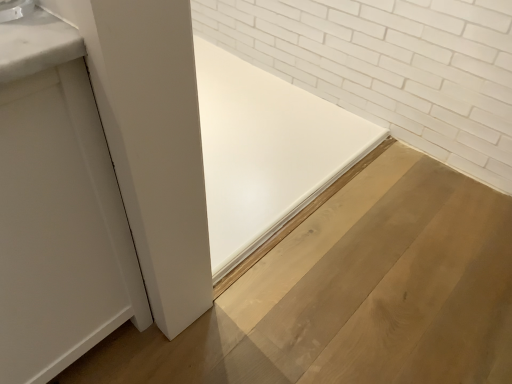
Question: Is white matte door at left oriented towards natural wood plywood at center?

Choices:
 (A) no
 (B) yes

Answer: (A)

Question: Considering the relative sizes of white matte door at left and natural wood plywood at center in the image provided, is white matte door at left taller than natural wood plywood at center?

Choices:
 (A) no
 (B) yes

Answer: (B)

Question: Does white matte door at left appear on the right side of natural wood plywood at center?

Choices:
 (A) no
 (B) yes

Answer: (A)

Question: Does white matte door at left have a greater width compared to natural wood plywood at center?

Choices:
 (A) yes
 (B) no

Answer: (B)

Question: From a real-world perspective, is white matte door at left under natural wood plywood at center?

Choices:
 (A) no
 (B) yes

Answer: (A)

Question: In terms of width, does satin nickel faucet at upper left look wider or thinner when compared to white matte door at left?

Choices:
 (A) thin
 (B) wide

Answer: (A)

Question: In the image, is satin nickel faucet at upper left on the left side or the right side of white matte door at left?

Choices:
 (A) right
 (B) left

Answer: (A)

Question: Is satin nickel faucet at upper left situated inside white matte door at left or outside?

Choices:
 (A) inside
 (B) outside

Answer: (B)

Question: In terms of height, does satin nickel faucet at upper left look taller or shorter compared to white matte door at left?

Choices:
 (A) tall
 (B) short

Answer: (B)

Question: Is white matte door at left taller or shorter than satin nickel faucet at upper left?

Choices:
 (A) short
 (B) tall

Answer: (B)

Question: Is white matte door at left situated inside satin nickel faucet at upper left or outside?

Choices:
 (A) outside
 (B) inside

Answer: (A)

Question: Looking at the image, does white matte door at left seem bigger or smaller compared to satin nickel faucet at upper left?

Choices:
 (A) big
 (B) small

Answer: (A)

Question: From a real-world perspective, is white matte door at left positioned above or below satin nickel faucet at upper left?

Choices:
 (A) above
 (B) below

Answer: (B)

Question: Looking at their shapes, would you say white matte door at left is wider or thinner than natural wood plywood at center?

Choices:
 (A) wide
 (B) thin

Answer: (B)

Question: Does point (55, 109) appear closer or farther from the camera than point (329, 354)?

Choices:
 (A) farther
 (B) closer

Answer: (B)